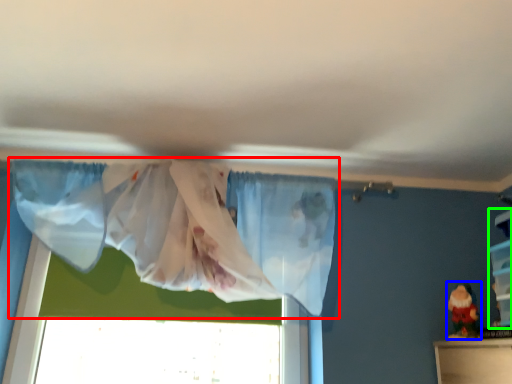
Question: Based on their relative distances, which object is farther from curtain (highlighted by a red box)? Choose from toy (highlighted by a blue box) and shelf (highlighted by a green box).

Choices:
 (A) toy
 (B) shelf

Answer: (B)